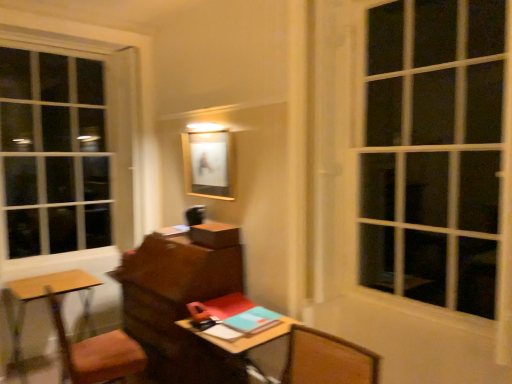
Locate an element on the screen. wooden cushioned chair at lower left is located at coordinates (97, 353).

The height and width of the screenshot is (384, 512). Find the location of `wooden desk at center`. wooden desk at center is located at coordinates (243, 336).

The image size is (512, 384). Describe the element at coordinates (42, 298) in the screenshot. I see `wooden table at lower left` at that location.

Where is `wooden cushioned chair at lower left`? wooden cushioned chair at lower left is located at coordinates (97, 353).

Is matte wooden picture frame at center positioned before wooden cushioned chair at lower left?

No, matte wooden picture frame at center is behind wooden cushioned chair at lower left.

Looking at this image, which of these two, matte wooden picture frame at center or wooden cushioned chair at lower left, is wider?

Wider between the two is wooden cushioned chair at lower left.

From a real-world perspective, is matte wooden picture frame at center above or below wooden cushioned chair at lower left?

From a real-world perspective, matte wooden picture frame at center is physically above wooden cushioned chair at lower left.

The height and width of the screenshot is (384, 512). I want to click on chair lying below the matte wooden picture frame at center (from the image's perspective), so click(97, 353).

From the picture: Is wooden cushioned chair at lower left next to wooden desk at center?

No, wooden cushioned chair at lower left is not beside wooden desk at center.

From a real-world perspective, does wooden cushioned chair at lower left stand above wooden desk at center?

Indeed, from a real-world perspective, wooden cushioned chair at lower left stands above wooden desk at center.

Is wooden cushioned chair at lower left positioned in front of wooden desk at center?

No, the depth of wooden cushioned chair at lower left is greater than that of wooden desk at center.

From the image's perspective, between wooden cushioned chair at lower left and wooden desk at center, which one is located above?

wooden cushioned chair at lower left.

Are wooden table at lower left and wooden cushioned chair at lower left far apart?

That's not correct — wooden table at lower left is a little close to wooden cushioned chair at lower left.

Who is shorter, wooden table at lower left or wooden cushioned chair at lower left?

wooden table at lower left is shorter.

Between wooden table at lower left and wooden cushioned chair at lower left, which one is positioned behind?

Positioned behind is wooden table at lower left.

From a real-world perspective, does white glass window at upper right stand above wooden cushioned chair at lower left?

Indeed, from a real-world perspective, white glass window at upper right stands above wooden cushioned chair at lower left.

Is point (465, 6) more distant than point (130, 358)?

No, it is in front of (130, 358).

From the image's perspective, which is above, white glass window at upper right or wooden cushioned chair at lower left?

white glass window at upper right, from the image's perspective.

Can wooden cushioned chair at lower left be found inside white glass window at upper right?

No.

Is white glass window at upper right bigger than teal matte notebook at center?

Yes.

Locate an element on the screen. Image resolution: width=512 pixels, height=384 pixels. notebook located behind the white glass window at upper right is located at coordinates (252, 321).

Which point is more distant from viewer, (411, 200) or (258, 326)?

Positioned behind is point (411, 200).

Can you see white glass window at upper right touching teal matte notebook at center?

There is a gap between white glass window at upper right and teal matte notebook at center.

Which is further, (44, 283) or (429, 13)?

The point (44, 283) is more distant.

From a real-world perspective, between wooden table at lower left and white glass window at upper right, who is vertically lower?

From a 3D spatial view, wooden table at lower left is below.

Could you tell me if wooden table at lower left is turned towards white glass window at upper right?

Yes, wooden table at lower left faces towards white glass window at upper right.

Is wooden table at lower left far away from white glass window at upper right?

Yes.

Which object is further away from the camera taking this photo, wooden cushioned chair at lower left or matte wooden picture frame at center?

matte wooden picture frame at center is further from the camera.

Is wooden cushioned chair at lower left shorter than matte wooden picture frame at center?

No, wooden cushioned chair at lower left is not shorter than matte wooden picture frame at center.

Is matte wooden picture frame at center at the back of wooden cushioned chair at lower left?

wooden cushioned chair at lower left is not turned away from matte wooden picture frame at center.

Is point (68, 357) positioned in front of point (197, 180)?

Yes.

You are a GUI agent. You are given a task and a screenshot of the screen. Output one action in this format:
    pyautogui.click(x=<x>, y=<y>)
    Task: Click on the chair on the left side of matte wooden picture frame at center
    
    Given the screenshot: What is the action you would take?
    pyautogui.click(x=97, y=353)

This screenshot has height=384, width=512. Identify the location of desk below the wooden cushioned chair at lower left (from the image's perspective). (243, 336).

Estimate the real-world distances between objects in this image. Which object is closer to white glass window at upper right, teal matte notebook at center or wooden table at lower left?

teal matte notebook at center is positioned closer to the anchor white glass window at upper right.

When comparing their distances from matte wooden picture frame at center, does wooden cushioned chair at lower left or wooden table at lower left seem further?

wooden cushioned chair at lower left is positioned further to the anchor matte wooden picture frame at center.

Estimate the real-world distances between objects in this image. Which object is closer to matte wooden picture frame at center, white glass window at upper right or wooden desk at center?

wooden desk at center is closer to matte wooden picture frame at center.

Which object lies further to the anchor point wooden cushioned chair at lower left, wooden desk at center or white glass window at upper right?

white glass window at upper right is positioned further to the anchor wooden cushioned chair at lower left.

Which object lies nearer to the anchor point teal matte notebook at center, wooden table at lower left or matte wooden picture frame at center?

matte wooden picture frame at center lies closer to teal matte notebook at center than the other object.

When comparing their distances from white glass window at upper right, does matte wooden picture frame at center or wooden table at lower left seem closer?

Based on the image, matte wooden picture frame at center appears to be nearer to white glass window at upper right.

Looking at the image, which one is located closer to wooden desk at center, wooden cushioned chair at lower left or matte wooden picture frame at center?

wooden cushioned chair at lower left is closer to wooden desk at center.

Based on their spatial positions, is wooden desk at center or wooden table at lower left further from teal matte notebook at center?

wooden table at lower left is positioned further to the anchor teal matte notebook at center.

At what (x,y) coordinates should I click in order to perform the action: click on desk between wooden table at lower left and teal matte notebook at center from left to right. Please return your answer as a coordinate pair (x, y). Image resolution: width=512 pixels, height=384 pixels. Looking at the image, I should click on (243, 336).

You are a GUI agent. You are given a task and a screenshot of the screen. Output one action in this format:
    pyautogui.click(x=<x>, y=<y>)
    Task: Click on the chair located between wooden table at lower left and wooden desk at center in the left-right direction
    The width and height of the screenshot is (512, 384).
    Given the screenshot: What is the action you would take?
    pyautogui.click(x=97, y=353)

Identify the location of notebook between matte wooden picture frame at center and wooden desk at center in the up-down direction. pos(252,321).

Image resolution: width=512 pixels, height=384 pixels. What are the coordinates of `notebook between white glass window at upper right and wooden desk at center in the vertical direction` in the screenshot? It's located at (252, 321).